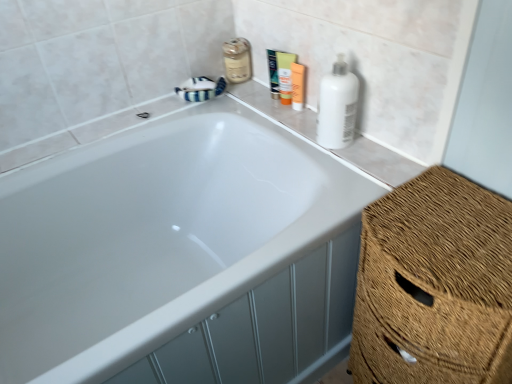
Question: Which direction should I rotate to look at green plastic tube at upper center, which is the 3th toiletry in right-to-left order?

Choices:
 (A) left
 (B) right

Answer: (B)

Question: Is green plastic tube at upper center, positioned as the first toiletry in left-to-right order, far away from matte glass mouthwash at upper center?

Choices:
 (A) no
 (B) yes

Answer: (A)

Question: Is green plastic tube at upper center, which is the 3th toiletry in right-to-left order, next to matte glass mouthwash at upper center and touching it?

Choices:
 (A) yes
 (B) no

Answer: (B)

Question: Is green plastic tube at upper center, which is the 3th toiletry in right-to-left order, to the right of matte glass mouthwash at upper center from the viewer's perspective?

Choices:
 (A) yes
 (B) no

Answer: (A)

Question: From the image's perspective, is green plastic tube at upper center, which is the 3th toiletry in right-to-left order, located beneath matte glass mouthwash at upper center?

Choices:
 (A) no
 (B) yes

Answer: (B)

Question: Considering the relative sizes of green plastic tube at upper center, positioned as the first toiletry in left-to-right order, and matte glass mouthwash at upper center in the image provided, is green plastic tube at upper center, positioned as the first toiletry in left-to-right order, bigger than matte glass mouthwash at upper center?

Choices:
 (A) no
 (B) yes

Answer: (A)

Question: Is green plastic tube at upper center, which is the 3th toiletry in right-to-left order, shorter than matte glass mouthwash at upper center?

Choices:
 (A) yes
 (B) no

Answer: (B)

Question: Is matte orange tube at upper center, positioned as the second toiletry in right-to-left order, not close to orange matte lotion at upper center, which is counted as the 1th toiletry, starting from the right?

Choices:
 (A) no
 (B) yes

Answer: (A)

Question: Can you confirm if matte orange tube at upper center, the second toiletry when ordered from left to right, is positioned to the right of orange matte lotion at upper center, which is the 3th toiletry in left-to-right order?

Choices:
 (A) yes
 (B) no

Answer: (B)

Question: Considering the relative sizes of matte orange tube at upper center, positioned as the second toiletry in right-to-left order, and orange matte lotion at upper center, which is counted as the 1th toiletry, starting from the right, in the image provided, is matte orange tube at upper center, positioned as the second toiletry in right-to-left order, wider than orange matte lotion at upper center, which is counted as the 1th toiletry, starting from the right,?

Choices:
 (A) no
 (B) yes

Answer: (B)

Question: Can you confirm if matte orange tube at upper center, positioned as the second toiletry in right-to-left order, is taller than orange matte lotion at upper center, which is counted as the 1th toiletry, starting from the right?

Choices:
 (A) yes
 (B) no

Answer: (A)

Question: From a real-world perspective, is matte orange tube at upper center, positioned as the second toiletry in right-to-left order, over orange matte lotion at upper center, which is counted as the 1th toiletry, starting from the right?

Choices:
 (A) no
 (B) yes

Answer: (B)

Question: Does matte orange tube at upper center, the second toiletry when ordered from left to right, lie behind orange matte lotion at upper center, which is counted as the 1th toiletry, starting from the right?

Choices:
 (A) no
 (B) yes

Answer: (B)

Question: From the image's perspective, is white glossy bathtub at upper center located beneath green plastic tube at upper center, which is the 3th toiletry in right-to-left order?

Choices:
 (A) no
 (B) yes

Answer: (B)